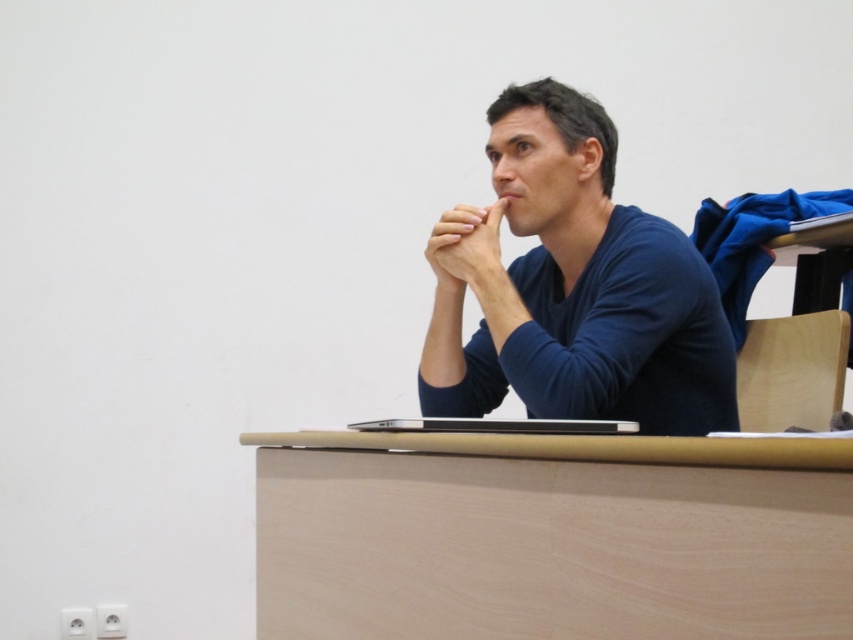
Question: Based on their relative distances, which object is farther from the blue matte sweater at center?

Choices:
 (A) light brown wood table at center
 (B) smooth skin hand at center
 (C) sleek silver laptop at center

Answer: (A)

Question: Which point appears farthest from the camera in this image?

Choices:
 (A) (498, 214)
 (B) (482, 243)

Answer: (A)

Question: Does light brown wood table at center come behind blue matte sweater at center?

Choices:
 (A) no
 (B) yes

Answer: (A)

Question: Does light brown wood table at center come in front of smooth skin hand at center?

Choices:
 (A) yes
 (B) no

Answer: (A)

Question: In this image, where is blue matte sweater at center located relative to smooth skin hand at center?

Choices:
 (A) above
 (B) below

Answer: (B)

Question: Which object is the closest to the light brown wood table at center?

Choices:
 (A) sleek silver laptop at center
 (B) blue matte sweater at center

Answer: (A)